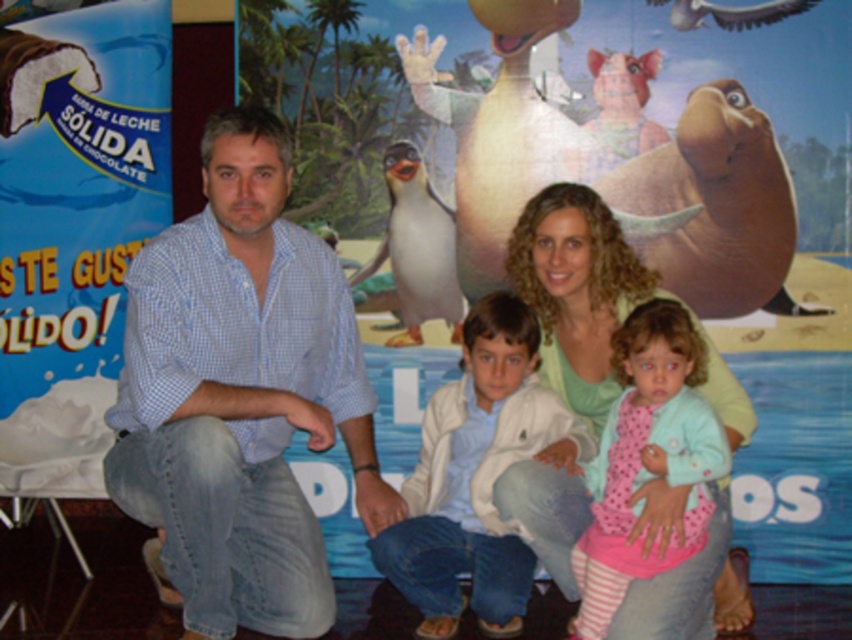
Is point (521, 429) positioned after point (591, 413)?

No, (521, 429) is closer to viewer.

Where is `white cotton shirt at center`? This screenshot has height=640, width=852. white cotton shirt at center is located at coordinates (476, 477).

Find the location of a particular element. The width and height of the screenshot is (852, 640). white cotton shirt at center is located at coordinates (476, 477).

Can you confirm if blue checkered shirt at left is positioned to the left of pink striped fabric at center?

Yes, blue checkered shirt at left is to the left of pink striped fabric at center.

Can you confirm if blue checkered shirt at left is positioned below pink striped fabric at center?

Actually, blue checkered shirt at left is above pink striped fabric at center.

Is point (219, 564) behind point (712, 417)?

No, it is in front of (712, 417).

You are a GUI agent. You are given a task and a screenshot of the screen. Output one action in this format:
    pyautogui.click(x=<x>, y=<y>)
    Task: Click on the blue checkered shirt at left
    This screenshot has width=852, height=640.
    Given the screenshot: What is the action you would take?
    pyautogui.click(x=239, y=396)

Who is lower down, light blue checkered shirt at center or pink striped fabric at center?

pink striped fabric at center

Based on the photo, between light blue checkered shirt at center and pink striped fabric at center, which one has more height?

pink striped fabric at center is taller.

I want to click on light blue checkered shirt at center, so click(x=571, y=275).